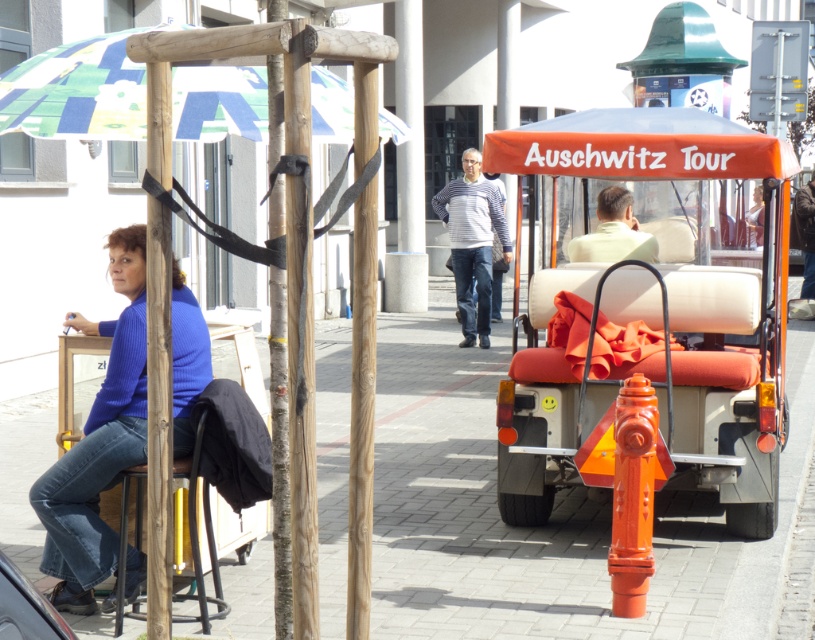
Question: Does smooth concrete pavement at center have a greater width compared to orange fabric golf cart at right?

Choices:
 (A) no
 (B) yes

Answer: (B)

Question: Does orange matte fire hydrant at lower right appear on the left side of striped cotton sweater at center?

Choices:
 (A) no
 (B) yes

Answer: (A)

Question: Which point is farther from the camera taking this photo?

Choices:
 (A) (652, 243)
 (B) (465, 237)
 (C) (179, 369)

Answer: (B)

Question: Which object is farther from the camera taking this photo?

Choices:
 (A) striped cotton sweater at center
 (B) metallic silver car at lower left

Answer: (A)

Question: Can you confirm if smooth concrete pavement at center is positioned below printed fabric umbrella at upper left?

Choices:
 (A) yes
 (B) no

Answer: (A)

Question: Considering the real-world distances, which object is closest to the printed fabric umbrella at upper left?

Choices:
 (A) metallic silver car at lower left
 (B) light green fabric at rear center
 (C) orange fabric golf cart at right

Answer: (C)